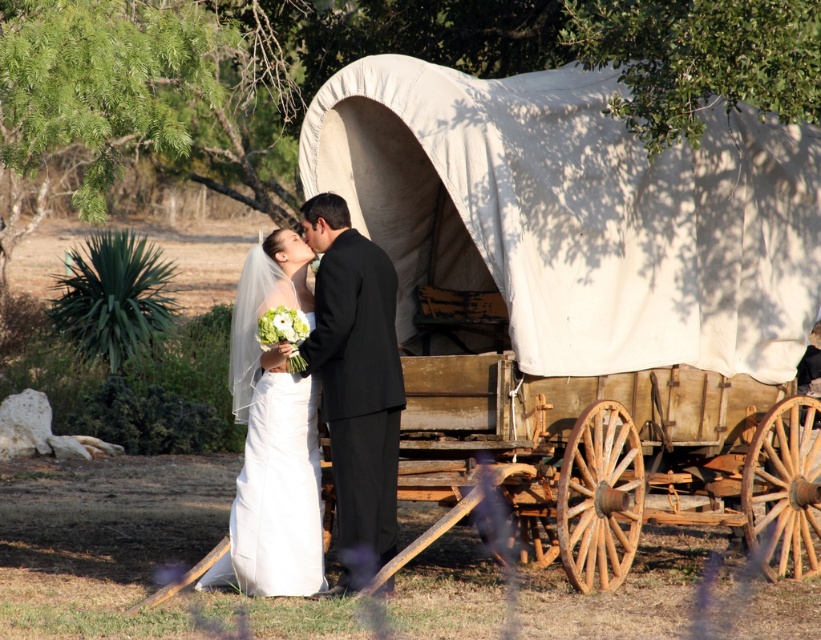
Based on the photo, is white canvas wagon at center to the left of white satin dress at center from the viewer's perspective?

Incorrect, white canvas wagon at center is not on the left side of white satin dress at center.

Is white canvas wagon at center positioned in front of white satin dress at center?

No, white canvas wagon at center is behind white satin dress at center.

What do you see at coordinates (578, 216) in the screenshot? I see `white canvas wagon at center` at bounding box center [578, 216].

Locate an element on the screen. white canvas wagon at center is located at coordinates [578, 216].

Who is shorter, white satin dress at center or black satin suit at center?

white satin dress at center

In the scene shown: Who is positioned more to the right, white satin dress at center or black satin suit at center?

black satin suit at center is more to the right.

I want to click on white satin dress at center, so click(273, 436).

How distant is white canvas wagon at center from black satin suit at center?

white canvas wagon at center is 1.50 meters away from black satin suit at center.

The image size is (821, 640). What do you see at coordinates (578, 216) in the screenshot?
I see `white canvas wagon at center` at bounding box center [578, 216].

This screenshot has height=640, width=821. What are the coordinates of `white canvas wagon at center` in the screenshot? It's located at (x=578, y=216).